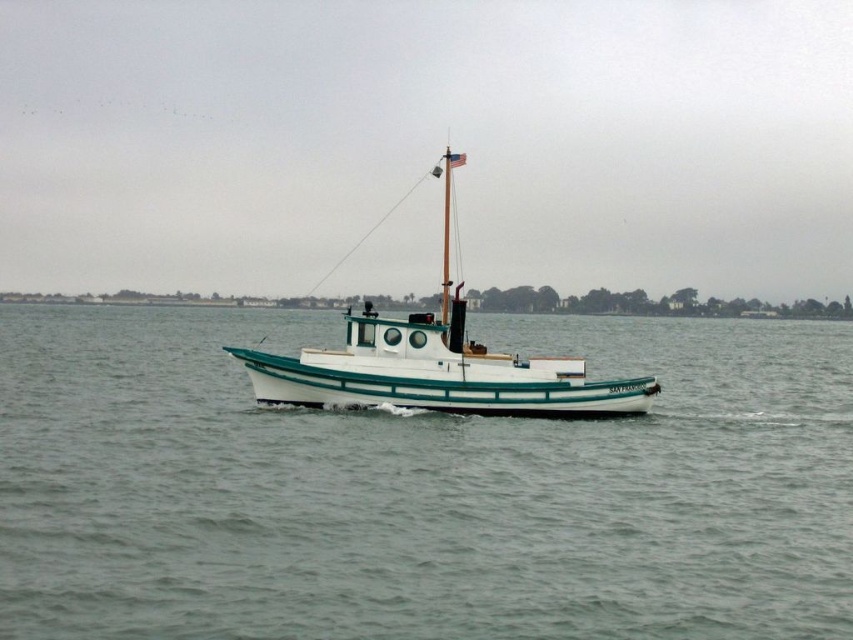
Can you confirm if white matte water at center is positioned above white glossy boat at center?

Incorrect, white matte water at center is not positioned above white glossy boat at center.

Does white matte water at center have a lesser height compared to white glossy boat at center?

Yes, white matte water at center is shorter than white glossy boat at center.

Find the location of `white matte water at center`. white matte water at center is located at coordinates (419, 486).

Where is `white matte water at center`? This screenshot has width=853, height=640. white matte water at center is located at coordinates (419, 486).